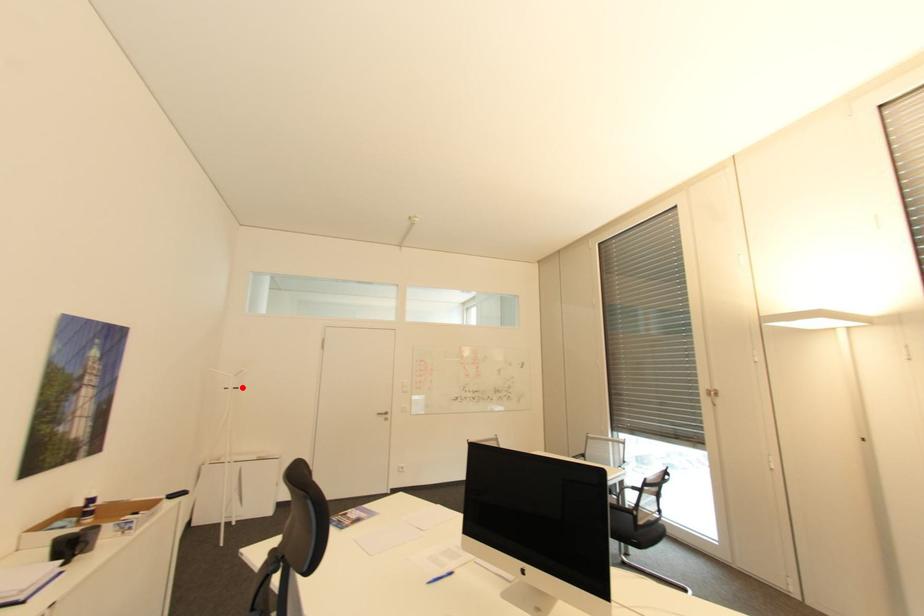
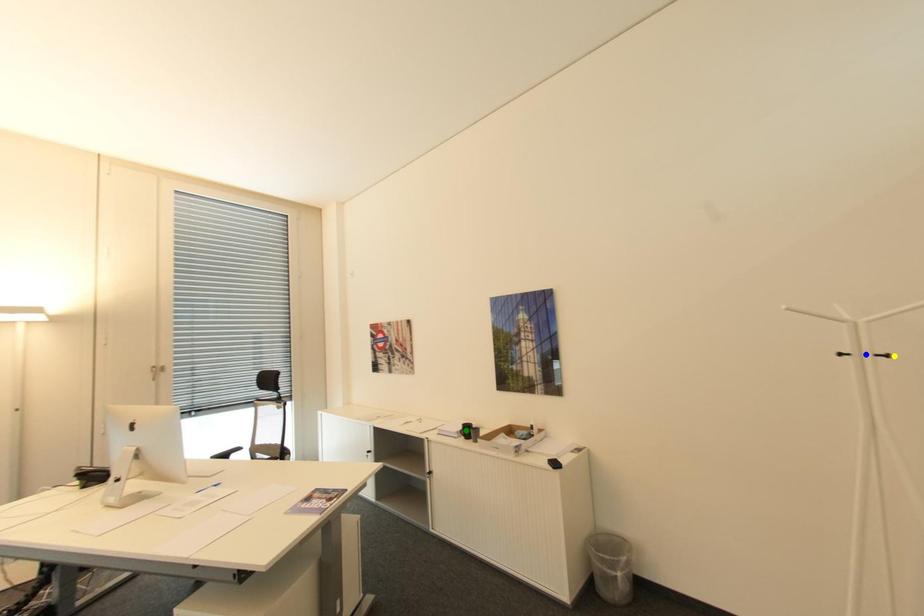
Question: I am providing you with two images of the same scene from different viewpoints. A red point is marked on the first image. You are given multiple points on the second image. Can you choose the point in image 2 that corresponds to the point in image 1?

Choices:
 (A) green point
 (B) blue point
 (C) yellow point

Answer: (C)